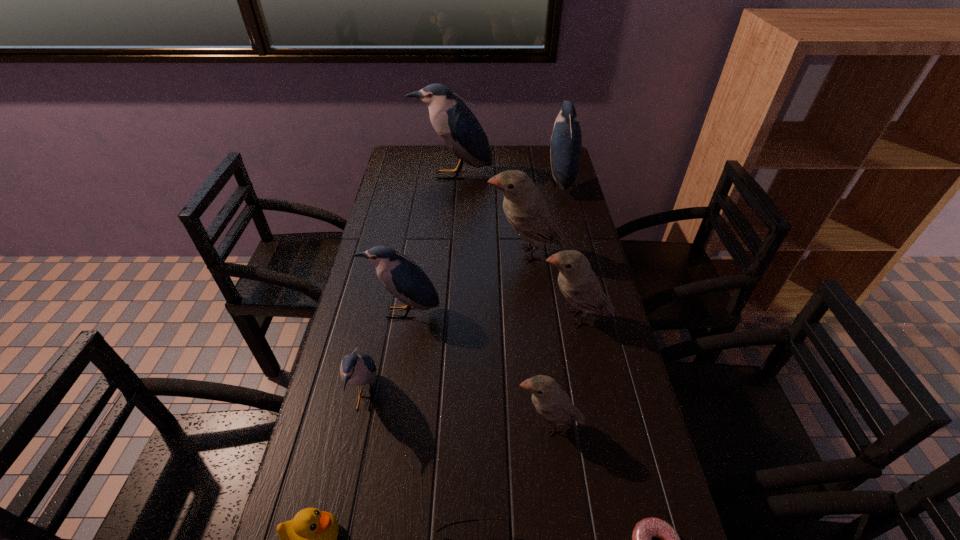
This screenshot has width=960, height=540. In order to click on the tallest bird in this screenshot , I will do `click(457, 126)`.

Locate an element on the screen. The width and height of the screenshot is (960, 540). the biggest blue bird is located at coordinates (457, 126).

Locate an element on the screen. The image size is (960, 540). the rightmost blue bird is located at coordinates (566, 140).

At what (x,y) coordinates should I click in order to perform the action: click on the third farthest bird. Please return your answer as a coordinate pair (x, y). This screenshot has height=540, width=960. Looking at the image, I should click on (525, 210).

Find the location of a particular element. the eighth nearest object is located at coordinates tap(525, 210).

Identify the location of the second smallest white bird. This screenshot has width=960, height=540. (577, 281).

This screenshot has height=540, width=960. I want to click on the third biggest blue bird, so click(x=401, y=276).

The height and width of the screenshot is (540, 960). What are the coordinates of `the smallest blue bird` in the screenshot? It's located at (357, 368).

Locate an element on the screen. the nearest white bird is located at coordinates (551, 402).

At what (x,y) coordinates should I click in order to perform the action: click on free location located 0.210m at the tip of the biggest blue bird's beak. Please return your answer as a coordinate pair (x, y). Looking at the image, I should click on (449, 216).